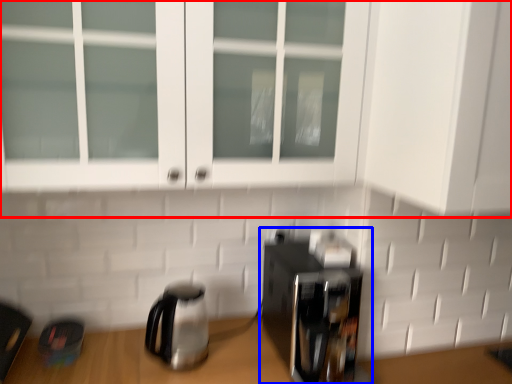
Question: Which object appears farthest to the camera in this image, cabinetry (highlighted by a red box) or coffee maker (highlighted by a blue box)?

Choices:
 (A) cabinetry
 (B) coffee maker

Answer: (B)